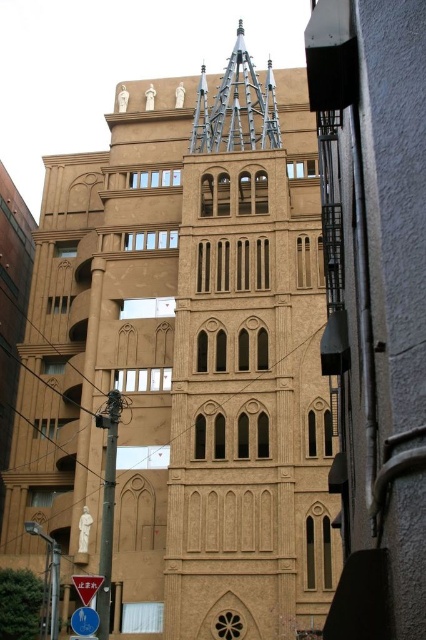
Question: Estimate the real-world distances between objects in this image. Which object is farther from the blue glossy sign at lower left?

Choices:
 (A) white plastic sign at lower left
 (B) shiny silver spire at center

Answer: (B)

Question: Does shiny silver spire at center have a lesser width compared to blue glossy sign at lower left?

Choices:
 (A) no
 (B) yes

Answer: (A)

Question: Can you confirm if shiny silver spire at center is bigger than blue glossy sign at lower left?

Choices:
 (A) yes
 (B) no

Answer: (A)

Question: Which of the following is the closest to the observer?

Choices:
 (A) shiny silver spire at center
 (B) white plastic sign at lower left

Answer: (B)

Question: Which object is farther from the camera taking this photo?

Choices:
 (A) shiny silver spire at center
 (B) blue glossy sign at lower left
 (C) white plastic sign at lower left

Answer: (A)

Question: Can you confirm if blue glossy sign at lower left is positioned to the left of white plastic sign at lower left?

Choices:
 (A) yes
 (B) no

Answer: (B)